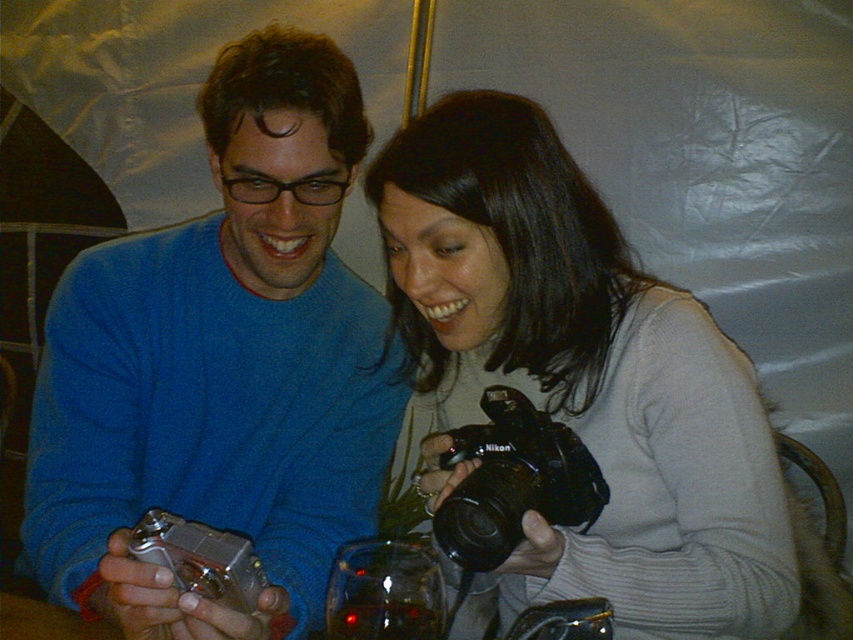
You are a photographer trying to set up two cameras for a photo shoot. The black plastic camera at center is placed in the middle of a table. You need to position the other camera exactly 25 inches away from it. Is the current placement of the camera meeting your requirement?

The distance between the black plastic camera at center and the other camera is 25.12 inches, which is very close to the required 25 inches. The placement is almost exact, so it should be acceptable for the photo shoot.

You are a photographer who needs to place a tripod between the matte blue sweater at center and the silver metallic digital camera at lower left. According to the scene description, where should you position the tripod?

The matte blue sweater at center is above the silver metallic digital camera at lower left, so you should place the tripod below the matte blue sweater at center and above the silver metallic digital camera at lower left to position it between them.

You are a photographer who needs to adjust the focus on the matte black camera at center. Considering your arm length is 24 inches, can you comfortably reach to adjust it without moving closer?

The matte black camera at center is 26.95 inches away from viewer. Since your arm length is 24 inches, you cannot comfortably reach it without moving closer.